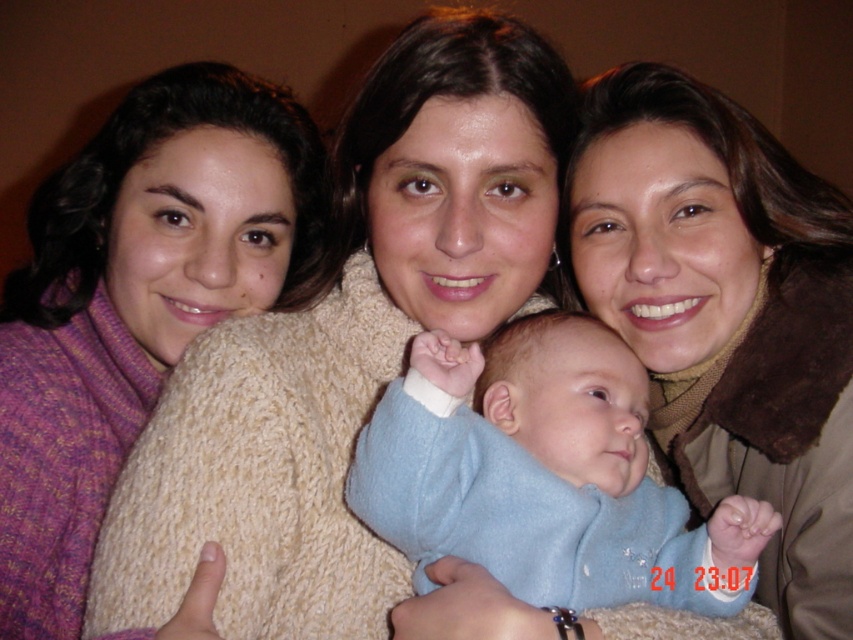
Which is more to the left, knitted sweater at center or light blue fleece at center?

knitted sweater at center is more to the left.

Which of these two, knitted sweater at center or light blue fleece at center, stands shorter?

light blue fleece at center is shorter.

Which is behind, point (306, 380) or point (585, 504)?

Positioned behind is point (306, 380).

At what (x,y) coordinates should I click in order to perform the action: click on knitted sweater at center. Please return your answer as a coordinate pair (x, y). Image resolution: width=853 pixels, height=640 pixels. Looking at the image, I should click on (346, 342).

Does point (646, 141) come farther from viewer compared to point (578, 472)?

Yes.

Does beige knitted sweater at center come behind light blue fleece at center?

Yes, beige knitted sweater at center is further from the viewer.

What do you see at coordinates (727, 314) in the screenshot?
I see `beige knitted sweater at center` at bounding box center [727, 314].

Locate an element on the screen. This screenshot has width=853, height=640. beige knitted sweater at center is located at coordinates (727, 314).

Can you confirm if knitted sweater at center is positioned to the left of beige knitted sweater at center?

Indeed, knitted sweater at center is positioned on the left side of beige knitted sweater at center.

This screenshot has width=853, height=640. What do you see at coordinates (346, 342) in the screenshot?
I see `knitted sweater at center` at bounding box center [346, 342].

Is point (517, 211) positioned after point (570, 173)?

No.

Find the location of `knitted sweater at center`. knitted sweater at center is located at coordinates (346, 342).